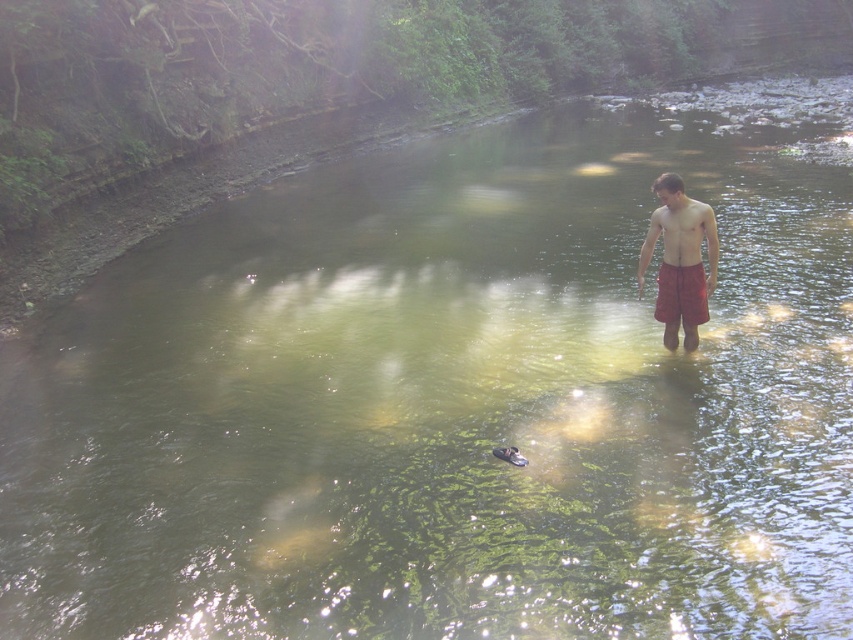
Does red plaid shorts at right have a smaller size compared to red cotton shorts at center?

→ Incorrect, red plaid shorts at right is not smaller in size than red cotton shorts at center.

Between red plaid shorts at right and red cotton shorts at center, which one appears on the left side from the viewer's perspective?

red plaid shorts at right

This screenshot has height=640, width=853. Describe the element at coordinates (680, 260) in the screenshot. I see `red plaid shorts at right` at that location.

I want to click on red plaid shorts at right, so click(680, 260).

Between red plaid shorts at right and matte red shorts at center, which one appears on the left side from the viewer's perspective?

matte red shorts at center

Who is more distant from viewer, (660, 310) or (694, 205)?

Positioned behind is point (660, 310).

Does point (674, 244) come behind point (674, 193)?

Yes, point (674, 244) is behind point (674, 193).

Identify the location of red plaid shorts at right. Image resolution: width=853 pixels, height=640 pixels. (680, 260).

Between point (646, 241) and point (670, 323), which one is positioned in front?

Point (646, 241) is in front.

Is point (685, 196) more distant than point (662, 310)?

No.

Which is in front, point (640, 253) or point (672, 285)?

Positioned in front is point (672, 285).

In order to click on matte red shorts at center in this screenshot , I will do `click(682, 232)`.